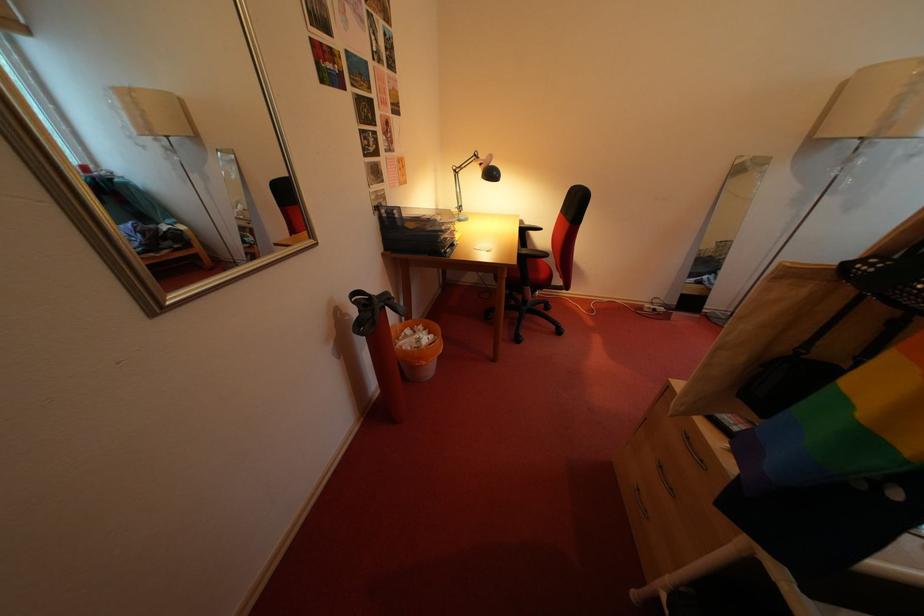
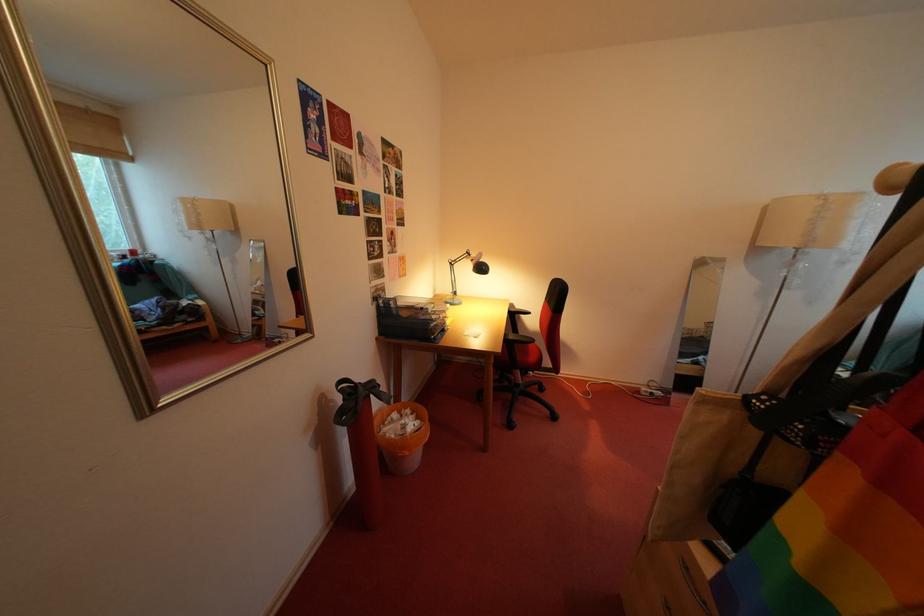
The images are taken continuously from a first-person perspective. In which direction are you moving?

The cameraman walked toward right, backward.